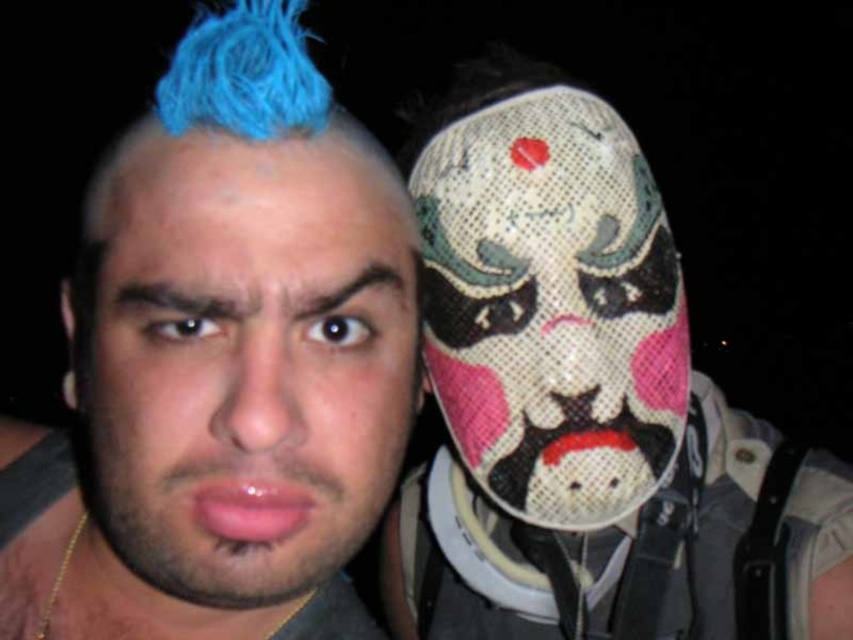
Question: Which object is farther from the camera taking this photo?

Choices:
 (A) matte blue hair at left
 (B) mesh fabric mask at right

Answer: (B)

Question: Where is mesh fabric mask at right located in relation to matte blue hair at left in the image?

Choices:
 (A) below
 (B) above

Answer: (A)

Question: Can you confirm if mesh fabric mask at right is positioned below matte blue hair at left?

Choices:
 (A) yes
 (B) no

Answer: (A)

Question: Can you confirm if mesh fabric mask at right is positioned to the left of matte blue hair at left?

Choices:
 (A) yes
 (B) no

Answer: (B)

Question: Among these objects, which one is nearest to the camera?

Choices:
 (A) matte blue hair at left
 (B) mesh fabric mask at right

Answer: (A)